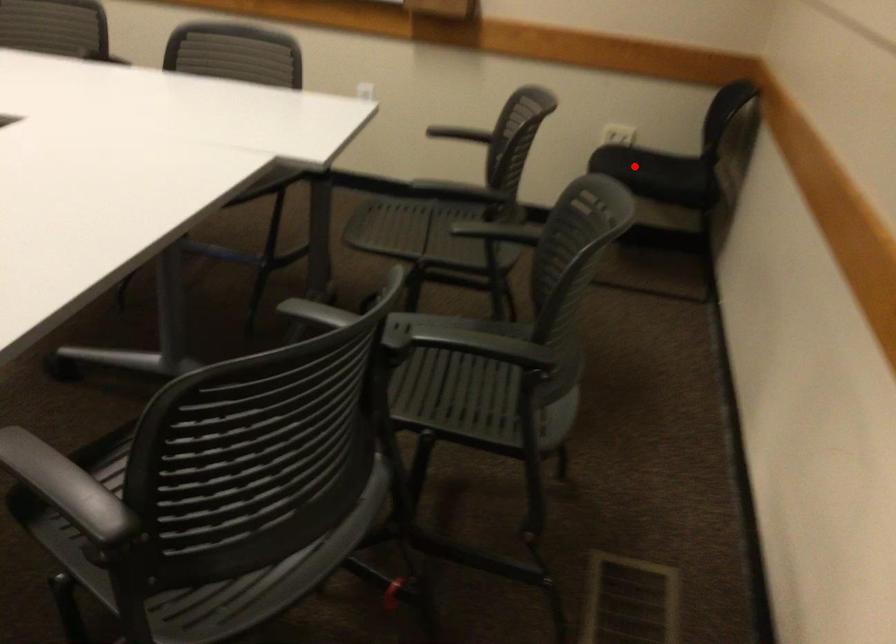
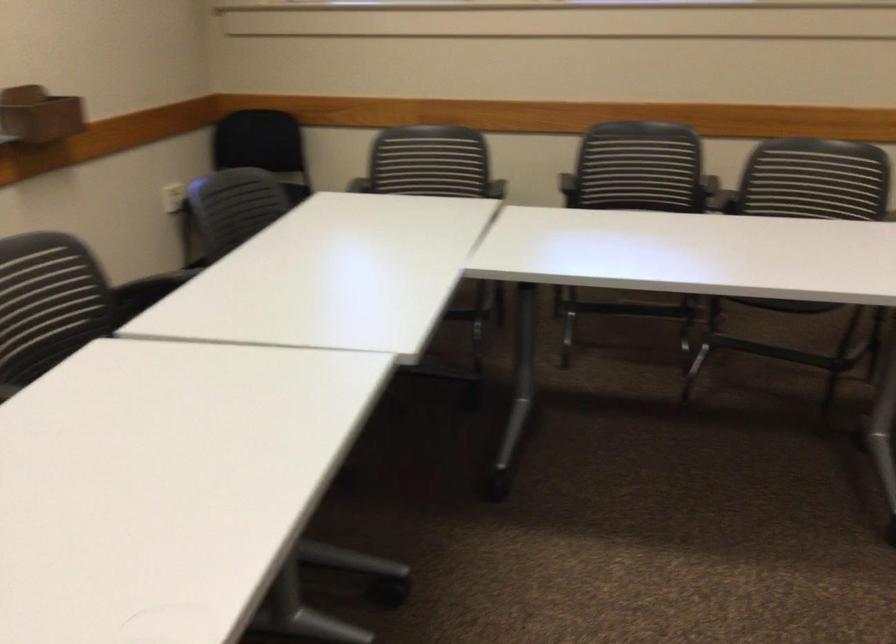
Question: I am providing you with two images of the same scene from different viewpoints. A red point is marked on the first image. Is the red point's position out of view in image 2?

Choices:
 (A) Yes
 (B) No

Answer: (A)